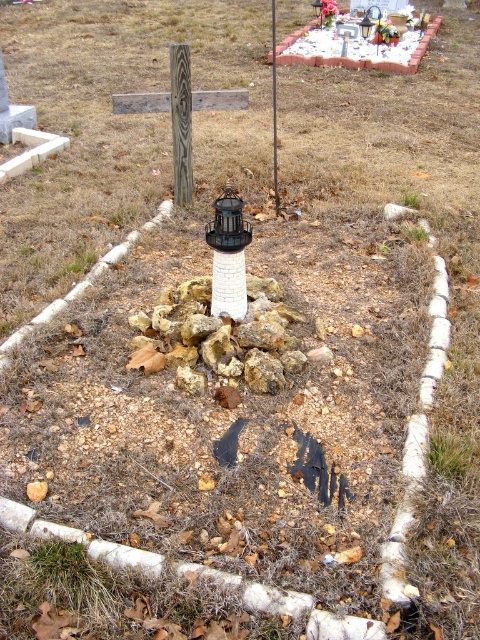
You are standing in front of the lighthouse and see the weathered wood post at center and the brushed wood post at center. Which one is positioned to the left side?

The weathered wood post at center is positioned to the left of the brushed wood post at center.

Consider the image. You are a landscape architect planning to install a new fence post in the cemetery. You have two options available at the site, the weathered wood post at center and the brushed wood post at center. Based on their heights, which one would you choose if you want the post to be taller than the existing lighthouse structure?

The brushed wood post at center is taller than the weathered wood post at center, so you should choose the brushed wood post at center to ensure it is taller than the existing lighthouse structure.

You are standing at the point marked as point (434, 472) in the image. You want to place a small flower pot that is 0.5 meters wide between yourself and the lighthouse. Is there enough space to do so?

The distance between point (434, 472) and the viewer is 2.48 meters. Since the flower pot is 0.5 meters wide, there is sufficient space to place it between yourself and the lighthouse as the distance is greater than the pot width.